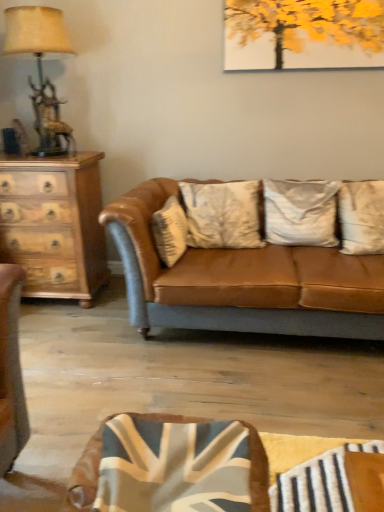
Question: Visually, is wooden chest of drawers at left positioned to the left or to the right of matte gold table lamp at left?

Choices:
 (A) left
 (B) right

Answer: (A)

Question: Considering the positions of wooden chest of drawers at left and matte gold table lamp at left in the image, is wooden chest of drawers at left bigger or smaller than matte gold table lamp at left?

Choices:
 (A) small
 (B) big

Answer: (B)

Question: Estimate the real-world distances between objects in this image. Which object is closer to the white textured pillow at center, which is counted as the 3th pillow, starting from the right?

Choices:
 (A) wooden chest of drawers at left
 (B) white cotton pillow at center, the 2th pillow when ordered from left to right
 (C) matte brown leather couch at center
 (D) matte gold table lamp at left
 (E) silky white pillow at center, the third pillow positioned from the left

Answer: (C)

Question: Which object is positioned farthest from the white textured pillow at center, the first pillow viewed from the left?

Choices:
 (A) matte brown leather couch at center
 (B) silky white pillow at center, which ranks as the 1th pillow in right-to-left order
 (C) wooden chest of drawers at left
 (D) white cotton pillow at center, the second pillow positioned from the right
 (E) matte gold table lamp at left

Answer: (B)